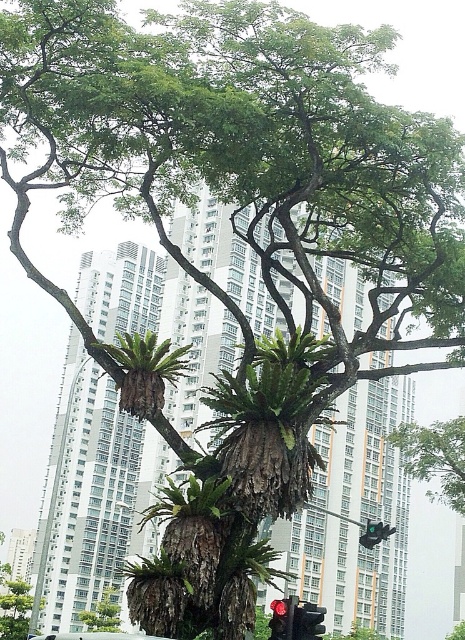
Can you confirm if brown textured fern at center is wider than white matte car at lower center?

Incorrect, brown textured fern at center's width does not surpass white matte car at lower center's.

Is brown textured fern at center above white matte car at lower center?

Indeed, brown textured fern at center is positioned over white matte car at lower center.

Is point (125, 384) positioned after point (119, 637)?

Yes, point (125, 384) is behind point (119, 637).

Image resolution: width=465 pixels, height=640 pixels. Identify the location of brown textured fern at center. (145, 371).

Which is in front, point (130, 566) or point (117, 602)?

Point (130, 566)

Who is positioned more to the left, green rough textured fern at center or green rough bark tree at lower left?

green rough bark tree at lower left is more to the left.

Where is `green rough textured fern at center`? Image resolution: width=465 pixels, height=640 pixels. green rough textured fern at center is located at coordinates (157, 572).

Between point (451, 432) and point (15, 616), which one is positioned behind?

Positioned behind is point (15, 616).

Which is more to the left, green leafy tree at center or green rough bark tree at center?

Positioned to the left is green rough bark tree at center.

Does point (451, 476) lie behind point (17, 627)?

No, (451, 476) is closer to viewer.

I want to click on green leafy tree at center, so click(x=436, y=458).